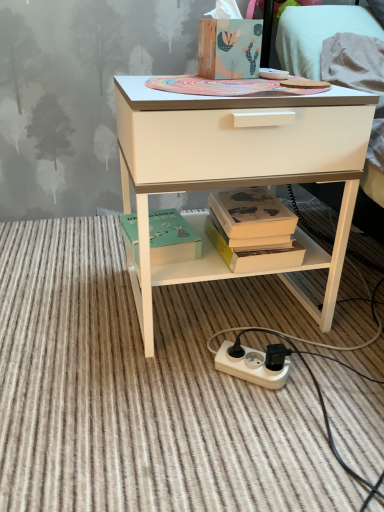
Identify the location of white plastic power strip at lower center. The height and width of the screenshot is (512, 384). (150, 387).

What do you see at coordinates (251, 367) in the screenshot? This screenshot has width=384, height=512. I see `white plastic power outlet at lower center` at bounding box center [251, 367].

What is the approximate height of white matte desk at center?

The height of white matte desk at center is 21.58 inches.

Image resolution: width=384 pixels, height=512 pixels. What do you see at coordinates (229, 48) in the screenshot?
I see `wooden tissue box at upper center, the first box viewed from the top` at bounding box center [229, 48].

What are the coordinates of `wooden tissue box at upper center, the second box from the bottom` in the screenshot? It's located at (229, 48).

The width and height of the screenshot is (384, 512). In order to click on hardcover book at center in this screenshot , I will do `click(253, 230)`.

Is green matte box at lower center, marked as the first box in a left-to-right arrangement, positioned before wooden tissue box at upper center, the first box viewed from the top?

No, the depth of green matte box at lower center, marked as the first box in a left-to-right arrangement, is greater than that of wooden tissue box at upper center, the first box viewed from the top.

Does green matte box at lower center, arranged as the second box when viewed from the right, appear on the right side of wooden tissue box at upper center, placed as the 2th box when sorted from left to right?

Incorrect, green matte box at lower center, arranged as the second box when viewed from the right, is not on the right side of wooden tissue box at upper center, placed as the 2th box when sorted from left to right.

Would you say green matte box at lower center, arranged as the second box when viewed from the right, is a long distance from wooden tissue box at upper center, placed as the 2th box when sorted from left to right?

No, there isn't a large distance between green matte box at lower center, arranged as the second box when viewed from the right, and wooden tissue box at upper center, placed as the 2th box when sorted from left to right.

Can you see white plastic power strip at lower center touching white plastic power outlet at lower center?

No, white plastic power strip at lower center is not beside white plastic power outlet at lower center.

Does white plastic power strip at lower center have a larger size compared to white plastic power outlet at lower center?

Yes, white plastic power strip at lower center is bigger than white plastic power outlet at lower center.

From the image's perspective, is white plastic power strip at lower center above or below white plastic power outlet at lower center?

From the image's perspective, white plastic power strip at lower center appears above white plastic power outlet at lower center.

From their relative heights in the image, would you say green matte box at lower center, the 2th box viewed from the top, is taller or shorter than white plastic power strip at lower center?

green matte box at lower center, the 2th box viewed from the top, is taller than white plastic power strip at lower center.

Would you say green matte box at lower center, the 2th box viewed from the top, is outside white plastic power strip at lower center?

Yes, green matte box at lower center, the 2th box viewed from the top, is not within white plastic power strip at lower center.

From a real-world perspective, which is physically below, green matte box at lower center, the 2th box viewed from the top, or white plastic power strip at lower center?

white plastic power strip at lower center.

Which object is wider, white plastic power outlet at lower center or green matte box at lower center, marked as the first box in a bottom-to-top arrangement?

With larger width is green matte box at lower center, marked as the first box in a bottom-to-top arrangement.

Is white plastic power outlet at lower center with green matte box at lower center, the 2th box viewed from the top?

No, white plastic power outlet at lower center is not making contact with green matte box at lower center, the 2th box viewed from the top.

Could green matte box at lower center, marked as the first box in a bottom-to-top arrangement, be considered to be inside white plastic power outlet at lower center?

No.

Which object is positioned more to the left, white plastic power outlet at lower center or green matte box at lower center, the 2th box viewed from the top?

From the viewer's perspective, green matte box at lower center, the 2th box viewed from the top, appears more on the left side.

Could you tell me if white matte desk at center is facing white plastic power strip at lower center?

No, white matte desk at center is not turned towards white plastic power strip at lower center.

Who is smaller, white matte desk at center or white plastic power strip at lower center?

white plastic power strip at lower center.

Is the surface of white matte desk at center in direct contact with white plastic power strip at lower center?

No, white matte desk at center is not next to white plastic power strip at lower center.

From a real-world perspective, which object rests below the other?

white plastic power outlet at lower center, from a real-world perspective.

In terms of height, does white plastic power outlet at lower center look taller or shorter compared to white matte desk at center?

In the image, white plastic power outlet at lower center appears to be shorter than white matte desk at center.

Locate an element on the screen. desk that appears on the left of white plastic power outlet at lower center is located at coordinates (237, 168).

How many degrees apart are the facing directions of white plastic power outlet at lower center and white matte desk at center?

The facing directions of white plastic power outlet at lower center and white matte desk at center are 39.7 degrees apart.

Considering the sizes of objects white matte desk at center and hardcover book at center in the image provided, who is wider, white matte desk at center or hardcover book at center?

With larger width is white matte desk at center.

Is point (211, 99) less distant than point (263, 240)?

Yes, it is.

From the image's perspective, which object appears higher, white matte desk at center or hardcover book at center?

From the image's view, white matte desk at center is above.

From a real-world perspective, between white matte desk at center and hardcover book at center, who is vertically lower?

hardcover book at center, from a real-world perspective.

Locate an element on the screen. The width and height of the screenshot is (384, 512). box in front of the green matte box at lower center, arranged as the second box when viewed from the right is located at coordinates (229, 48).

Locate an element on the screen. plain located on the right of white plastic power outlet at lower center is located at coordinates (150, 387).

Considering their positions, is white plastic power strip at lower center positioned closer to white plastic power outlet at lower center than green matte box at lower center, the 2th box viewed from the top?

The object closer to white plastic power outlet at lower center is white plastic power strip at lower center.

Estimate the real-world distances between objects in this image. Which object is closer to white plastic power strip at lower center, wooden tissue box at upper center, the second box from the bottom, or white plastic power outlet at lower center?

white plastic power outlet at lower center lies closer to white plastic power strip at lower center than the other object.

Considering their positions, is wooden tissue box at upper center, the second box from the bottom, positioned closer to white plastic power strip at lower center than hardcover book at center?

Among the two, hardcover book at center is located nearer to white plastic power strip at lower center.

Estimate the real-world distances between objects in this image. Which object is further from green matte box at lower center, the 2th box viewed from the top, white plastic power outlet at lower center or wooden tissue box at upper center, the first box viewed from the top?

Among the two, wooden tissue box at upper center, the first box viewed from the top, is located further to green matte box at lower center, the 2th box viewed from the top.

From the image, which object appears to be farther from white matte desk at center, green matte box at lower center, marked as the first box in a left-to-right arrangement, or wooden tissue box at upper center, the first box viewed from the top?

The object further to white matte desk at center is wooden tissue box at upper center, the first box viewed from the top.

Based on the photo, from the image, which object appears to be nearer to white plastic power outlet at lower center, hardcover book at center or white plastic power strip at lower center?

white plastic power strip at lower center is closer to white plastic power outlet at lower center.

Looking at the image, which one is located closer to hardcover book at center, white matte desk at center or wooden tissue box at upper center, positioned as the first box in right-to-left order?

white matte desk at center is positioned closer to the anchor hardcover book at center.

Estimate the real-world distances between objects in this image. Which object is further from wooden tissue box at upper center, the first box viewed from the top, white plastic power outlet at lower center or green matte box at lower center, marked as the first box in a bottom-to-top arrangement?

white plastic power outlet at lower center.

Where is `book between wooden tissue box at upper center, placed as the 2th box when sorted from left to right, and white plastic power strip at lower center vertically`? book between wooden tissue box at upper center, placed as the 2th box when sorted from left to right, and white plastic power strip at lower center vertically is located at coordinates (253, 230).

Where is `box between wooden tissue box at upper center, positioned as the first box in right-to-left order, and white plastic power strip at lower center vertically`? box between wooden tissue box at upper center, positioned as the first box in right-to-left order, and white plastic power strip at lower center vertically is located at coordinates (172, 238).

You are a GUI agent. You are given a task and a screenshot of the screen. Output one action in this format:
    pyautogui.click(x=<x>, y=<y>)
    Task: Click on the plain that lies between white matte desk at center and white plastic power outlet at lower center from top to bottom
    
    Given the screenshot: What is the action you would take?
    pyautogui.click(x=150, y=387)

The width and height of the screenshot is (384, 512). In order to click on desk between wooden tissue box at upper center, placed as the 2th box when sorted from left to right, and white plastic power strip at lower center in the up-down direction in this screenshot , I will do `click(237, 168)`.